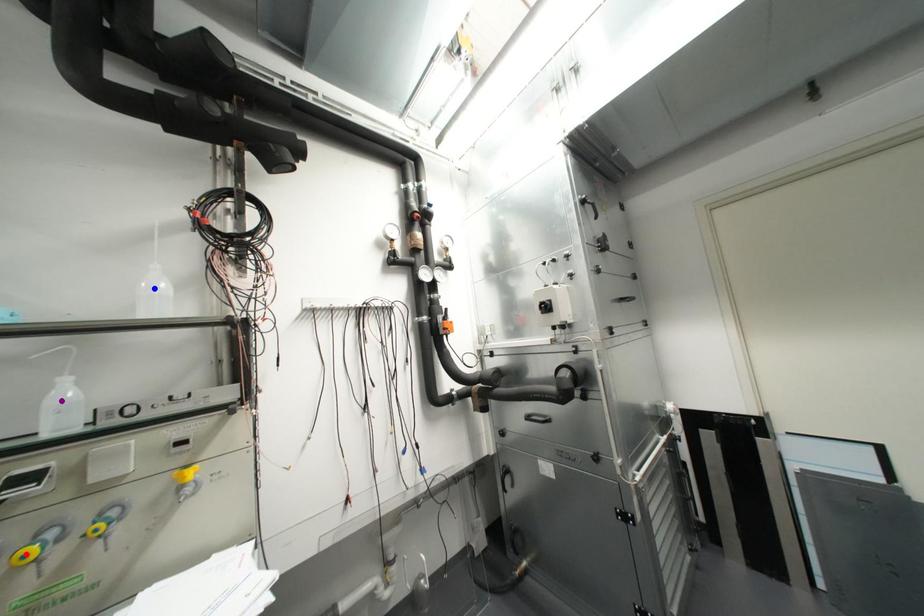
Order these from nearest to farthest:
purple point, blue point, red point

red point
purple point
blue point